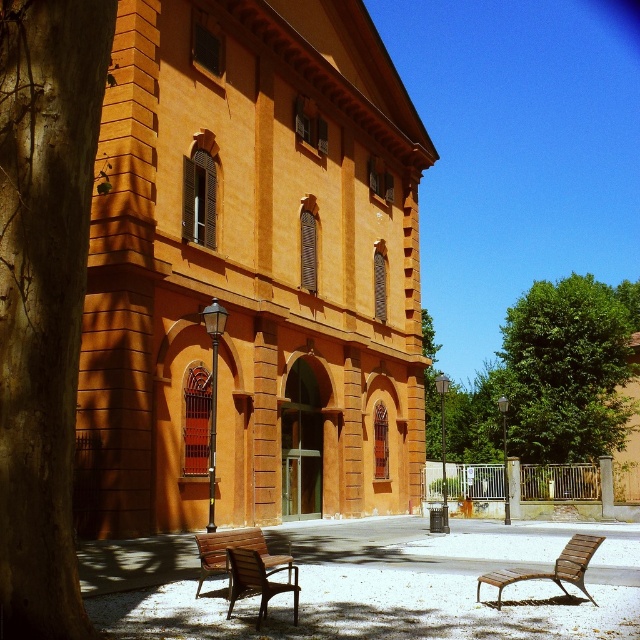
Question: Is smooth brown tree trunk at left further to the viewer compared to brown wooden chair at lower center?

Choices:
 (A) yes
 (B) no

Answer: (B)

Question: Among these points, which one is farthest from the camera?

Choices:
 (A) (593, 438)
 (B) (572, 561)
 (C) (19, 467)

Answer: (A)

Question: Is smooth brown tree trunk at left further to camera compared to wooden park bench at lower left?

Choices:
 (A) no
 (B) yes

Answer: (A)

Question: Which object is positioned closest to the brown wooden bench at lower right?

Choices:
 (A) brown wooden chair at lower center
 (B) wooden park bench at lower left

Answer: (A)

Question: Among these points, which one is nearest to the camera?

Choices:
 (A) (42, 16)
 (B) (248, 538)
 (C) (241, 572)

Answer: (A)

Question: Is smooth brown tree trunk at left to the right of green leafy tree at center from the viewer's perspective?

Choices:
 (A) no
 (B) yes

Answer: (A)